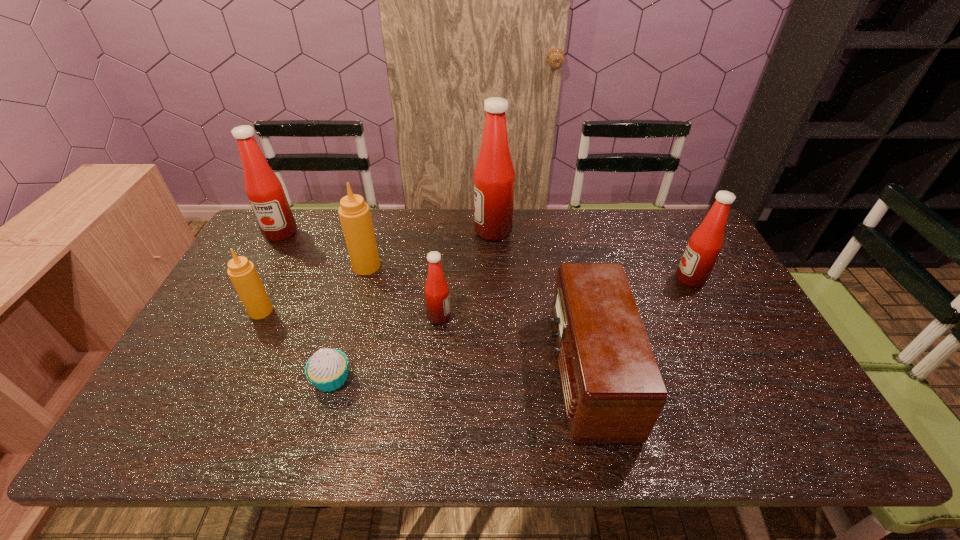
You are a GUI agent. You are given a task and a screenshot of the screen. Output one action in this format:
    pyautogui.click(x=<x>, y=<y>)
    Task: Click on the biggest red condiment
    
    Given the screenshot: What is the action you would take?
    pyautogui.click(x=494, y=176)

This screenshot has height=540, width=960. I want to click on the fifth condiment from left to right, so [494, 176].

Image resolution: width=960 pixels, height=540 pixels. Identify the location of the seventh shortest object. (264, 190).

Identify the location of the leftmost red condiment. (264, 190).

Where is `the right tan condiment`? Image resolution: width=960 pixels, height=540 pixels. the right tan condiment is located at coordinates (354, 213).

Where is `the bigger tan condiment`? This screenshot has height=540, width=960. the bigger tan condiment is located at coordinates (354, 213).

Locate an element on the screen. The height and width of the screenshot is (540, 960). the third farthest red condiment is located at coordinates (704, 246).

I want to click on the rightmost condiment, so click(704, 246).

The width and height of the screenshot is (960, 540). I want to click on the left tan condiment, so click(242, 273).

Where is `the nearer tan condiment`? Image resolution: width=960 pixels, height=540 pixels. the nearer tan condiment is located at coordinates (242, 273).